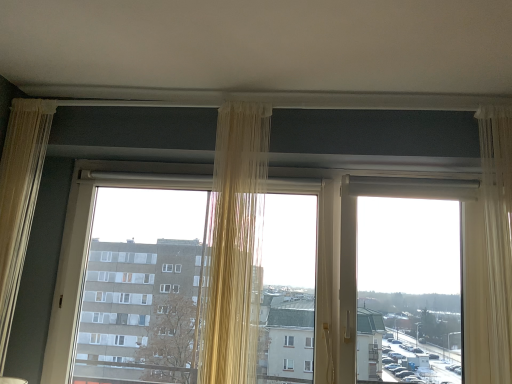
Where is `translucent beige curtain at center, the second curtain positioned from the left`? translucent beige curtain at center, the second curtain positioned from the left is located at coordinates (234, 241).

Where is `sheer beige curtain at left, the 1th curtain from the left`? The width and height of the screenshot is (512, 384). sheer beige curtain at left, the 1th curtain from the left is located at coordinates (19, 198).

You are a GUI agent. You are given a task and a screenshot of the screen. Output one action in this format:
    pyautogui.click(x=<x>, y=<y>)
    Task: Click on the translucent beige curtain at center, the second curtain positioned from the left
    This screenshot has height=384, width=512.
    Given the screenshot: What is the action you would take?
    pyautogui.click(x=234, y=241)

Considering the positions of points (417, 343) and (19, 213), is point (417, 343) farther from camera compared to point (19, 213)?

Yes.

Which is more to the right, transparent plastic window screen at right or sheer beige curtain at left, the 1th curtain from the left?

Positioned to the right is transparent plastic window screen at right.

From a real-world perspective, is transparent plastic window screen at right positioned over sheer beige curtain at left, the 3th curtain positioned from the right, based on gravity?

No, from a real-world perspective, transparent plastic window screen at right is not on top of sheer beige curtain at left, the 3th curtain positioned from the right.

Can you confirm if sheer white curtain at right, the first curtain in the right-to-left sequence, is taller than translucent beige curtain at center, positioned as the 2th curtain in right-to-left order?

No.

From a real-world perspective, is sheer white curtain at right, the first curtain in the right-to-left sequence, over translucent beige curtain at center, positioned as the 2th curtain in right-to-left order?

Indeed, from a real-world perspective, sheer white curtain at right, the first curtain in the right-to-left sequence, stands above translucent beige curtain at center, positioned as the 2th curtain in right-to-left order.

Where is `curtain that is the 1st object to the left of the sheer white curtain at right, placed as the 3th curtain when sorted from left to right, starting at the anchor`? This screenshot has width=512, height=384. curtain that is the 1st object to the left of the sheer white curtain at right, placed as the 3th curtain when sorted from left to right, starting at the anchor is located at coordinates point(234,241).

Which object is further away from the camera taking this photo, transparent plastic window screen at right or translucent beige curtain at center, the second curtain positioned from the left?

transparent plastic window screen at right is further from the camera.

Based on the photo, is translucent beige curtain at center, positioned as the 2th curtain in right-to-left order, inside transparent plastic window screen at right?

No, translucent beige curtain at center, positioned as the 2th curtain in right-to-left order, is not a part of transparent plastic window screen at right.

Is point (445, 330) positioned in front of point (245, 166)?

No.

From the image's perspective, between translucent fabric at center and translucent beige curtain at center, the second curtain positioned from the left, who is located below?

translucent fabric at center, from the image's perspective.

Considering the relative sizes of translucent fabric at center and translucent beige curtain at center, the second curtain positioned from the left, in the image provided, is translucent fabric at center taller than translucent beige curtain at center, the second curtain positioned from the left,?

Incorrect, the height of translucent fabric at center is not larger of that of translucent beige curtain at center, the second curtain positioned from the left.

Looking at their sizes, would you say translucent fabric at center is wider or thinner than translucent beige curtain at center, positioned as the 2th curtain in right-to-left order?

Clearly, translucent fabric at center has more width compared to translucent beige curtain at center, positioned as the 2th curtain in right-to-left order.

From a real-world perspective, between translucent beige curtain at center, positioned as the 2th curtain in right-to-left order, and transparent plastic window screen at right, who is vertically lower?

In real-world perspective, transparent plastic window screen at right is lower.

Does translucent beige curtain at center, the second curtain positioned from the left, have a greater width compared to transparent plastic window screen at right?

In fact, translucent beige curtain at center, the second curtain positioned from the left, might be narrower than transparent plastic window screen at right.

Is point (221, 267) closer to camera compared to point (402, 318)?

Yes, it is in front of point (402, 318).

Does translucent beige curtain at center, the second curtain positioned from the left, appear on the right side of transparent plastic window screen at right?

No.

How different are the orientations of translucent fabric at center and transparent plastic window screen at right in degrees?

0.000141 degrees.

From their relative heights in the image, would you say translucent fabric at center is taller or shorter than transparent plastic window screen at right?

Clearly, translucent fabric at center is taller compared to transparent plastic window screen at right.

Is translucent fabric at center facing towards transparent plastic window screen at right?

No, translucent fabric at center does not turn towards transparent plastic window screen at right.

Which of these two, translucent fabric at center or transparent plastic window screen at right, is thinner?

transparent plastic window screen at right is thinner.

Is sheer beige curtain at left, the 1th curtain from the left, thinner than translucent fabric at center?

Yes, sheer beige curtain at left, the 1th curtain from the left, is thinner than translucent fabric at center.

Can translucent fabric at center be found inside sheer beige curtain at left, the 1th curtain from the left?

That's incorrect, translucent fabric at center is not inside sheer beige curtain at left, the 1th curtain from the left.

Identify the location of curtain located on the left of translucent fabric at center. The image size is (512, 384). (19, 198).

Is sheer beige curtain at left, the 3th curtain positioned from the right, beside translucent fabric at center?

sheer beige curtain at left, the 3th curtain positioned from the right, and translucent fabric at center are not in contact.

What are the coordinates of `window screen below the sheer beige curtain at left, the 1th curtain from the left (from a real-world perspective)` in the screenshot? It's located at 404,276.

At what (x,y) coordinates should I click in order to perform the action: click on curtain in front of the translucent beige curtain at center, the second curtain positioned from the left. Please return your answer as a coordinate pair (x, y). This screenshot has width=512, height=384. Looking at the image, I should click on (498, 233).

From the image, which object appears to be nearer to sheer white curtain at right, placed as the 3th curtain when sorted from left to right, sheer beige curtain at left, the 1th curtain from the left, or translucent beige curtain at center, the second curtain positioned from the left?

translucent beige curtain at center, the second curtain positioned from the left.

Which object lies nearer to the anchor point transparent plastic window screen at right, sheer beige curtain at left, the 3th curtain positioned from the right, or translucent fabric at center?

translucent fabric at center is positioned closer to the anchor transparent plastic window screen at right.

Looking at the image, which one is located further to translucent fabric at center, translucent beige curtain at center, positioned as the 2th curtain in right-to-left order, or transparent plastic window screen at right?

transparent plastic window screen at right is further to translucent fabric at center.

When comparing their distances from sheer beige curtain at left, the 1th curtain from the left, does translucent fabric at center or sheer white curtain at right, the first curtain in the right-to-left sequence, seem further?

sheer white curtain at right, the first curtain in the right-to-left sequence, lies further to sheer beige curtain at left, the 1th curtain from the left, than the other object.

Which object lies further to the anchor point translucent fabric at center, transparent plastic window screen at right or sheer beige curtain at left, the 1th curtain from the left?

The object further to translucent fabric at center is transparent plastic window screen at right.

When comparing their distances from translucent fabric at center, does sheer beige curtain at left, the 1th curtain from the left, or sheer white curtain at right, the first curtain in the right-to-left sequence, seem further?

sheer white curtain at right, the first curtain in the right-to-left sequence, is further to translucent fabric at center.

When comparing their distances from translucent fabric at center, does sheer white curtain at right, placed as the 3th curtain when sorted from left to right, or transparent plastic window screen at right seem closer?

transparent plastic window screen at right lies closer to translucent fabric at center than the other object.

Based on their spatial positions, is sheer beige curtain at left, the 3th curtain positioned from the right, or translucent beige curtain at center, positioned as the 2th curtain in right-to-left order, further from transparent plastic window screen at right?

The object further to transparent plastic window screen at right is sheer beige curtain at left, the 3th curtain positioned from the right.

Find the location of a particular element. window between sheer beige curtain at left, the 1th curtain from the left, and sheer white curtain at right, the first curtain in the right-to-left sequence is located at coordinates (112, 185).

The image size is (512, 384). In order to click on window screen between translucent beige curtain at center, the second curtain positioned from the left, and sheer white curtain at right, placed as the 3th curtain when sorted from left to right in this screenshot , I will do `click(404, 276)`.

Locate an element on the screen. This screenshot has height=384, width=512. curtain between translucent fabric at center and sheer white curtain at right, placed as the 3th curtain when sorted from left to right, from left to right is located at coordinates (234, 241).

Where is `window between sheer beige curtain at left, the 3th curtain positioned from the right, and transparent plastic window screen at right, in the horizontal direction`? The width and height of the screenshot is (512, 384). window between sheer beige curtain at left, the 3th curtain positioned from the right, and transparent plastic window screen at right, in the horizontal direction is located at coordinates (112, 185).